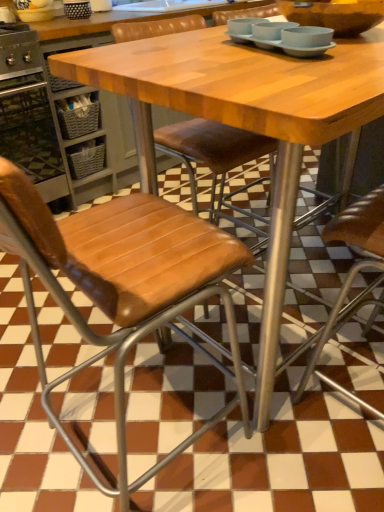
Question: Is point (67, 173) positioned closer to the camera than point (59, 223)?

Choices:
 (A) closer
 (B) farther

Answer: (B)

Question: From their relative heights in the image, would you say brushed metal oven at left is taller or shorter than brown leather chair at center, the 1th chair when ordered from right to left?

Choices:
 (A) short
 (B) tall

Answer: (B)

Question: Which object is positioned closest to the wooden table at center?

Choices:
 (A) brushed metal oven at left
 (B) brown leather chair at center, which ranks as the 2th chair in left-to-right order
 (C) brown leather chair at center, which is the 2th chair from right to left
 (D) light blue matte bowls at upper center
 (E) matte brown bowl at upper center

Answer: (D)

Question: Based on their relative distances, which object is farther from the wooden table at center?

Choices:
 (A) light blue matte bowls at upper center
 (B) brushed metal oven at left
 (C) brown leather chair at center, placed as the 1th chair when sorted from left to right
 (D) matte brown bowl at upper center
 (E) brown leather chair at center, which ranks as the 2th chair in left-to-right order

Answer: (B)